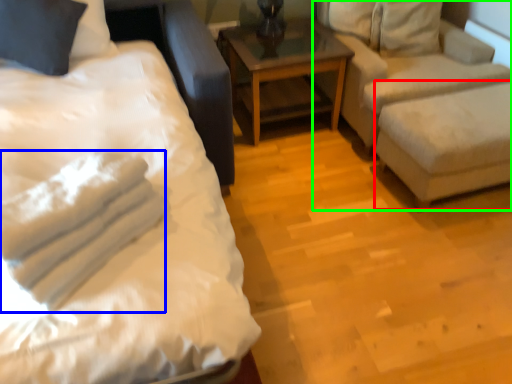
Question: Which object is positioned farthest from swivel chair (highlighted by a red box)? Select from material (highlighted by a blue box) and studio couch (highlighted by a green box).

Choices:
 (A) material
 (B) studio couch

Answer: (A)